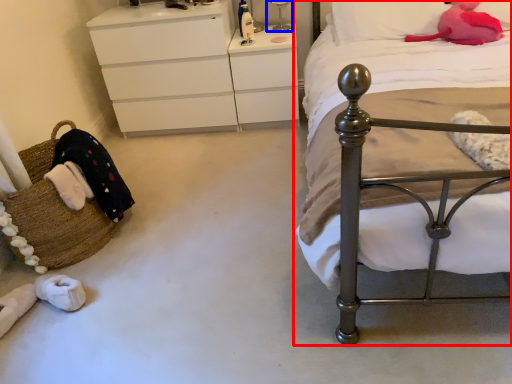
Question: Which point is closer to the camera, bed (highlighted by a red box) or bedside lamp (highlighted by a blue box)?

Choices:
 (A) bed
 (B) bedside lamp

Answer: (A)